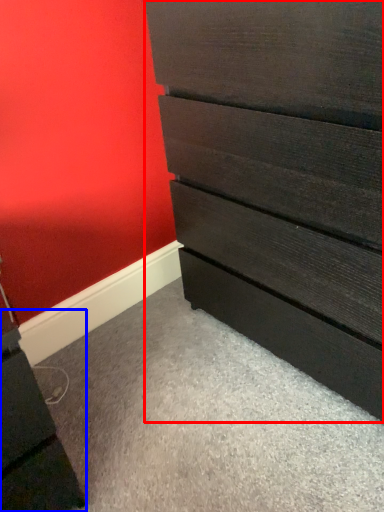
Question: Among these objects, which one is nearest to the camera, chest of drawers (highlighted by a red box) or file cabinet (highlighted by a blue box)?

Choices:
 (A) chest of drawers
 (B) file cabinet

Answer: (A)